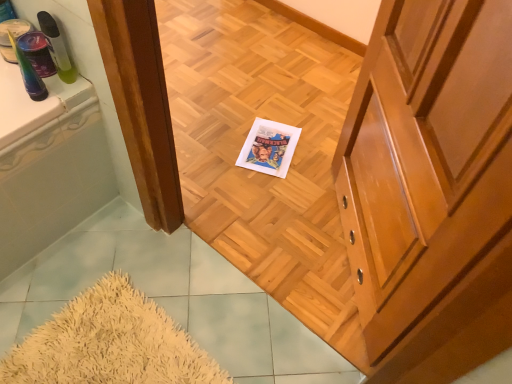
Question: Is shiny wood cabinet at right far away from translucent plastic spray bottle at upper left, marked as the 1th toiletry in a right-to-left arrangement?

Choices:
 (A) no
 (B) yes

Answer: (A)

Question: From the image's perspective, is shiny wood cabinet at right located above translucent plastic spray bottle at upper left, marked as the 1th toiletry in a right-to-left arrangement?

Choices:
 (A) yes
 (B) no

Answer: (B)

Question: From a real-world perspective, is shiny wood cabinet at right located higher than translucent plastic spray bottle at upper left, which ranks as the second toiletry in left-to-right order?

Choices:
 (A) yes
 (B) no

Answer: (B)

Question: Is shiny wood cabinet at right further to camera compared to translucent plastic spray bottle at upper left, which ranks as the second toiletry in left-to-right order?

Choices:
 (A) no
 (B) yes

Answer: (A)

Question: Would you say shiny wood cabinet at right is outside translucent plastic spray bottle at upper left, marked as the 1th toiletry in a right-to-left arrangement?

Choices:
 (A) no
 (B) yes

Answer: (B)

Question: From the image's perspective, would you say shiny wood cabinet at right is shown under translucent plastic spray bottle at upper left, marked as the 1th toiletry in a right-to-left arrangement?

Choices:
 (A) yes
 (B) no

Answer: (A)

Question: Is translucent plastic spray bottle at upper left, marked as the 1th toiletry in a right-to-left arrangement, positioned far away from shiny wood cabinet at right?

Choices:
 (A) yes
 (B) no

Answer: (B)

Question: Is shiny wood cabinet at right completely or partially inside translucent plastic spray bottle at upper left, marked as the 1th toiletry in a right-to-left arrangement?

Choices:
 (A) no
 (B) yes

Answer: (A)

Question: From a real-world perspective, is translucent plastic spray bottle at upper left, marked as the 1th toiletry in a right-to-left arrangement, over shiny wood cabinet at right?

Choices:
 (A) yes
 (B) no

Answer: (A)

Question: From a real-world perspective, is translucent plastic spray bottle at upper left, marked as the 1th toiletry in a right-to-left arrangement, under shiny wood cabinet at right?

Choices:
 (A) yes
 (B) no

Answer: (B)

Question: Is translucent plastic spray bottle at upper left, which ranks as the second toiletry in left-to-right order, thinner than shiny wood cabinet at right?

Choices:
 (A) no
 (B) yes

Answer: (B)

Question: Is translucent plastic spray bottle at upper left, which ranks as the second toiletry in left-to-right order, smaller than shiny wood cabinet at right?

Choices:
 (A) yes
 (B) no

Answer: (A)

Question: Considering the relative sizes of translucent plastic cup at upper left, which ranks as the 2th toiletry in right-to-left order, and translucent plastic spray bottle at upper left, which ranks as the second toiletry in left-to-right order, in the image provided, is translucent plastic cup at upper left, which ranks as the 2th toiletry in right-to-left order, bigger than translucent plastic spray bottle at upper left, which ranks as the second toiletry in left-to-right order,?

Choices:
 (A) yes
 (B) no

Answer: (A)